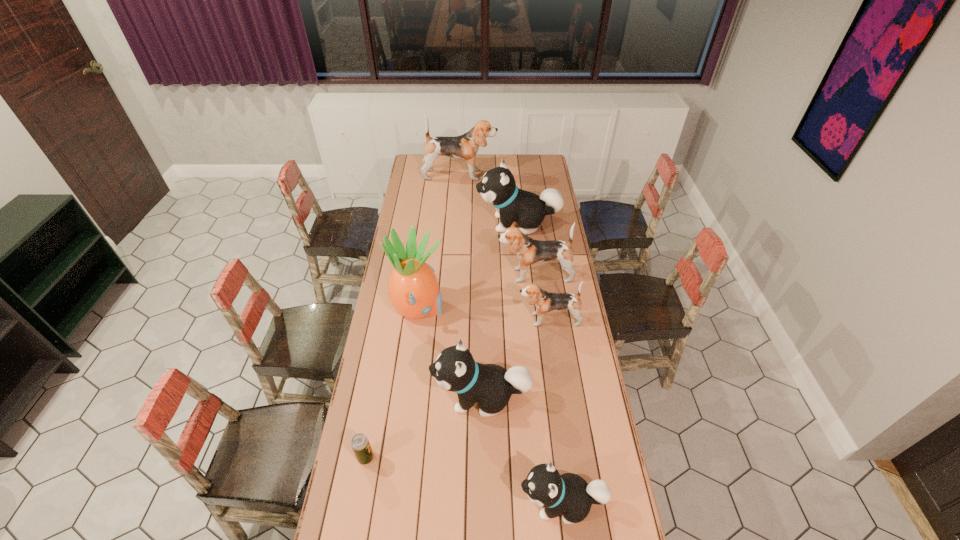
Find the location of `brown puppy that stands as the closest to the sixth nearest object`. brown puppy that stands as the closest to the sixth nearest object is located at coordinates (544, 301).

In order to click on white puppy that stands as the second closest to the biggest brown puppy in this screenshot , I will do `click(455, 370)`.

Where is `the second closest white puppy to the orange pineapple`? The image size is (960, 540). the second closest white puppy to the orange pineapple is located at coordinates (498, 187).